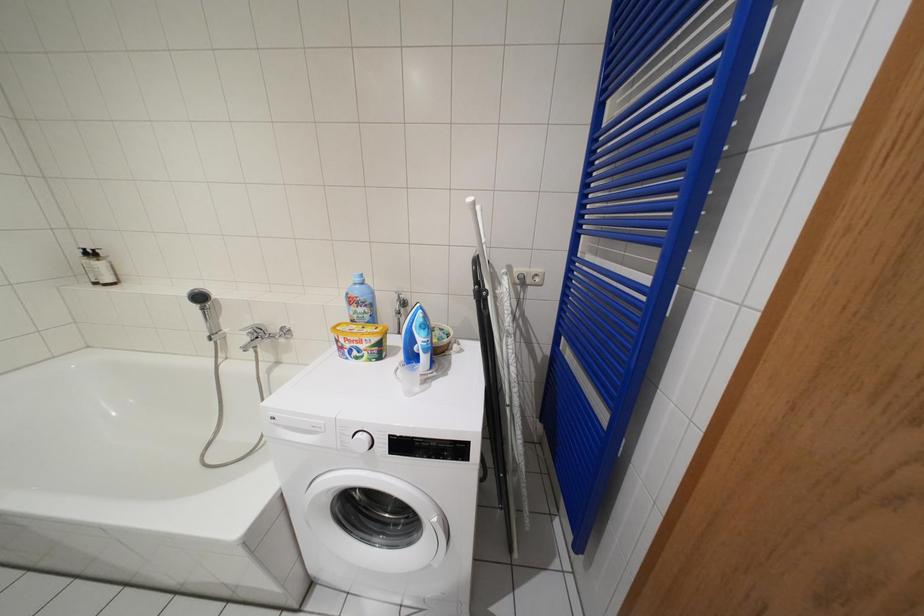
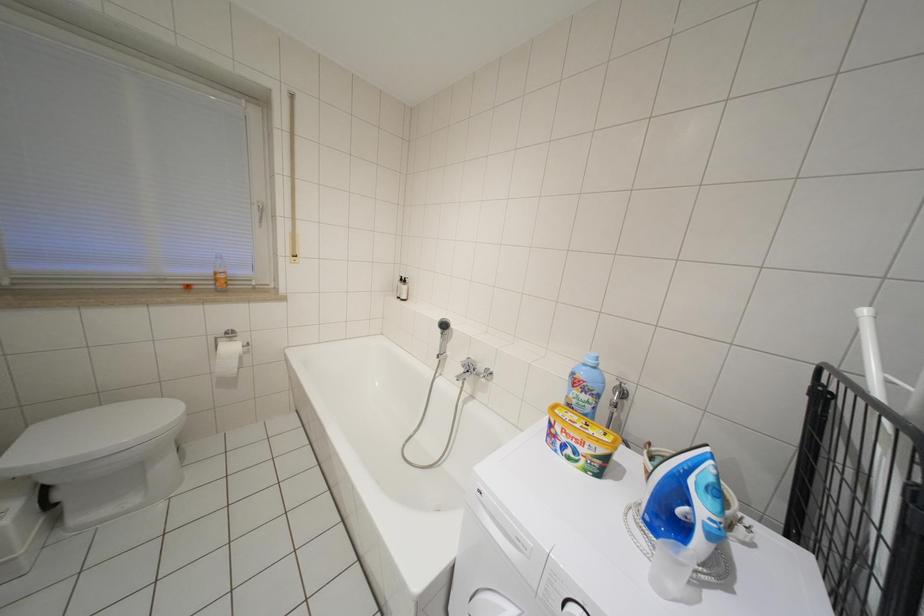
Question: How did the camera likely rotate?

Choices:
 (A) Left
 (B) Right
 (C) Up
 (D) Down

Answer: (A)